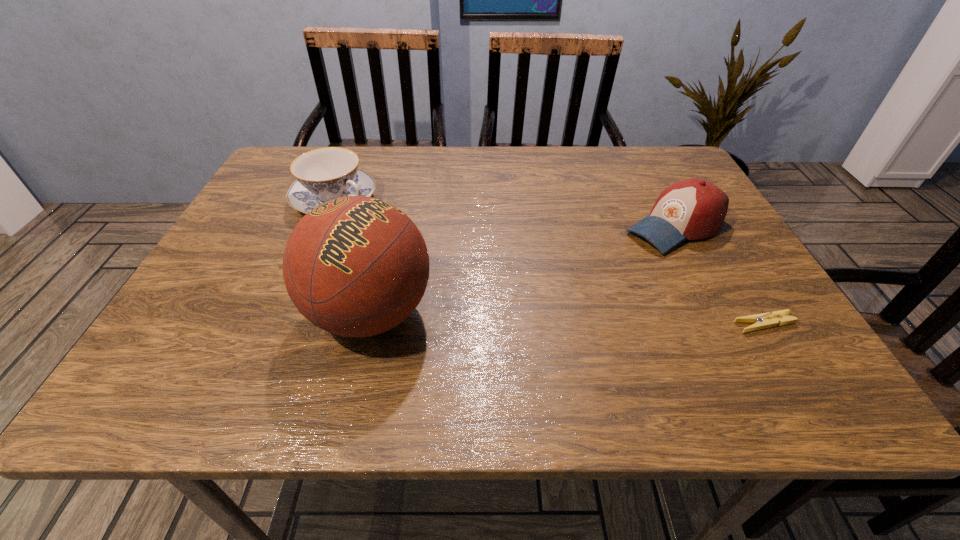
This screenshot has height=540, width=960. In order to click on vacant spot on the desktop that is between the basketball and the shortest object and is positioned on the front-facing side of the baseball cap in this screenshot , I will do `click(516, 317)`.

Where is `free space on the desktop that is between the tallest object and the shortest object and is positioned with the handle on the side of the chinaware`? free space on the desktop that is between the tallest object and the shortest object and is positioned with the handle on the side of the chinaware is located at coordinates (584, 319).